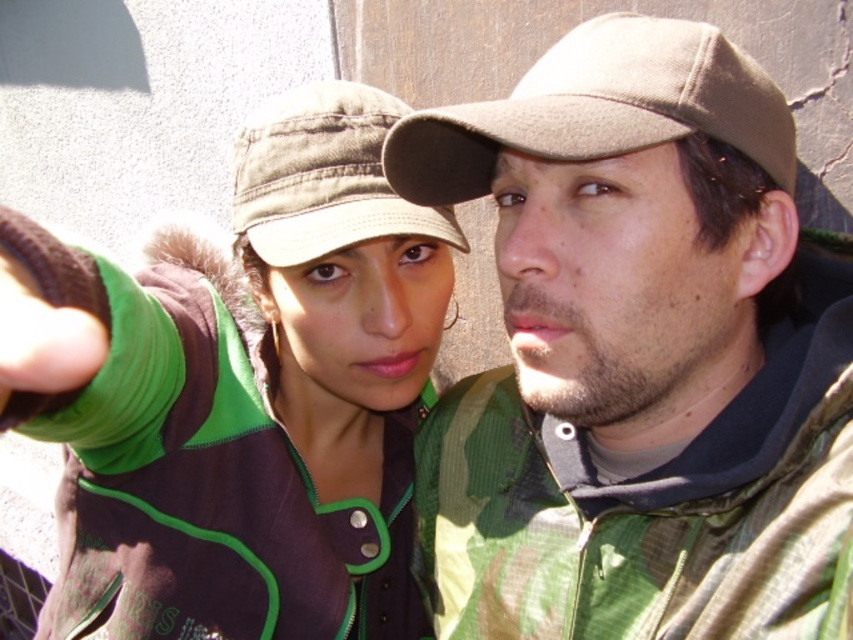
Can you confirm if camouflage fabric jacket at center is thinner than green corduroy jacket at center?

Correct, camouflage fabric jacket at center's width is less than green corduroy jacket at center's.

Does camouflage fabric jacket at center lie in front of green corduroy jacket at center?

No, it is behind green corduroy jacket at center.

Describe the element at coordinates (637, 356) in the screenshot. The width and height of the screenshot is (853, 640). I see `camouflage fabric jacket at center` at that location.

The width and height of the screenshot is (853, 640). Identify the location of camouflage fabric jacket at center. (637, 356).

Is the position of green corduroy jacket at center less distant than that of green fabric cap at center?

Yes, it is.

Which is above, green corduroy jacket at center or green fabric cap at center?

green fabric cap at center is above.

Where is `green corduroy jacket at center`? This screenshot has width=853, height=640. green corduroy jacket at center is located at coordinates (239, 394).

In the scene shown: Between camouflage fabric jacket at center and beige woolen cap at upper right, which one appears on the left side from the viewer's perspective?

From the viewer's perspective, camouflage fabric jacket at center appears more on the left side.

What do you see at coordinates (637, 356) in the screenshot? The width and height of the screenshot is (853, 640). I see `camouflage fabric jacket at center` at bounding box center [637, 356].

Which is behind, point (723, 445) or point (463, 113)?

The point (723, 445) is more distant.

Where is `camouflage fabric jacket at center`? The image size is (853, 640). camouflage fabric jacket at center is located at coordinates 637,356.